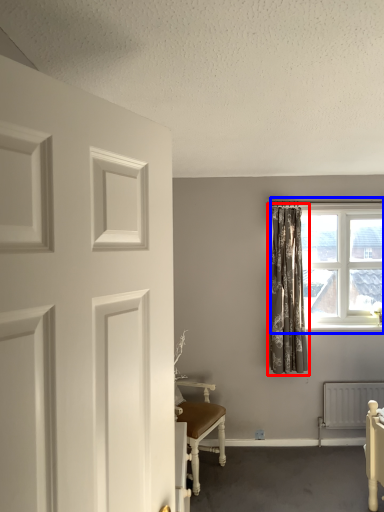
Question: Which object appears farthest to the camera in this image, curtain (highlighted by a red box) or window (highlighted by a blue box)?

Choices:
 (A) curtain
 (B) window

Answer: (B)